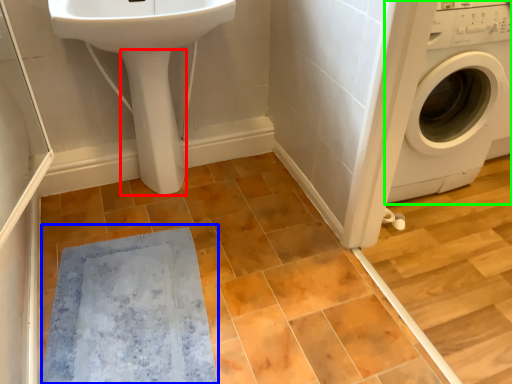
Question: Considering the real-world distances, which object is closest to bidet (highlighted by a red box)? bath mat (highlighted by a blue box) or washing machine (highlighted by a green box).

Choices:
 (A) bath mat
 (B) washing machine

Answer: (A)